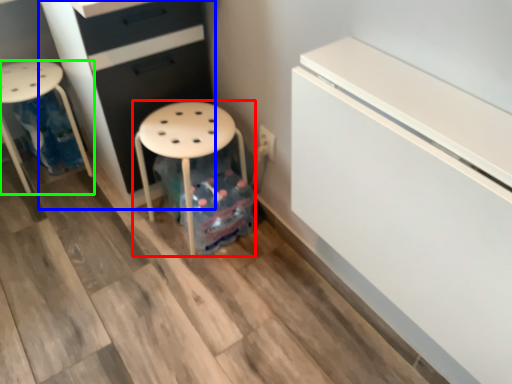
Question: Considering the real-world distances, which object is farthest from stool (highlighted by a red box)? chest of drawers (highlighted by a blue box) or furniture (highlighted by a green box)?

Choices:
 (A) chest of drawers
 (B) furniture

Answer: (B)